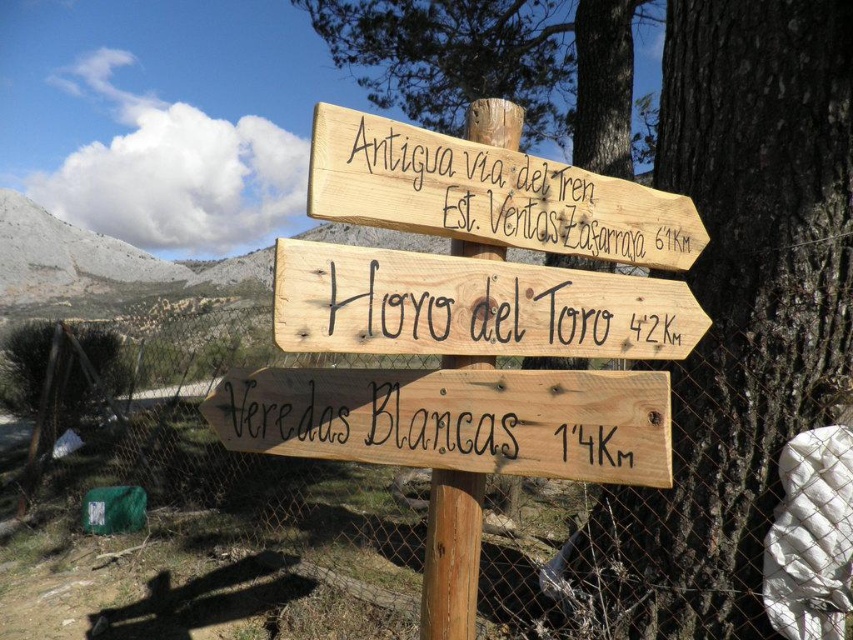
Question: Which object is closer to the camera taking this photo?

Choices:
 (A) wooden signpost at upper center
 (B) wooden sign at lower center
 (C) natural wood sign at center

Answer: (C)

Question: Can you confirm if natural wood signpost at center is positioned above wooden signpost at upper center?

Choices:
 (A) no
 (B) yes

Answer: (B)

Question: Can you confirm if wooden sign at lower center is positioned to the left of natural wood sign at center?

Choices:
 (A) yes
 (B) no

Answer: (A)

Question: Which of the following is the closest to the observer?

Choices:
 (A) (364, 129)
 (B) (833, 253)

Answer: (A)

Question: Which object is the farthest from the wooden signpost at upper center?

Choices:
 (A) natural wood sign at center
 (B) wooden sign at lower center
 (C) natural wood signpost at center

Answer: (C)

Question: Is natural wood signpost at center thinner than wooden sign at lower center?

Choices:
 (A) no
 (B) yes

Answer: (A)